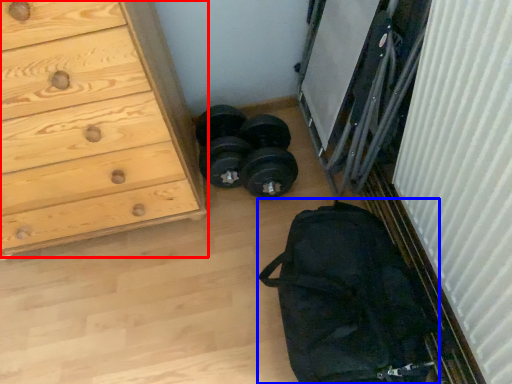
Question: Which point is closer to the camera, chest of drawers (highlighted by a red box) or bag (highlighted by a blue box)?

Choices:
 (A) chest of drawers
 (B) bag

Answer: (A)